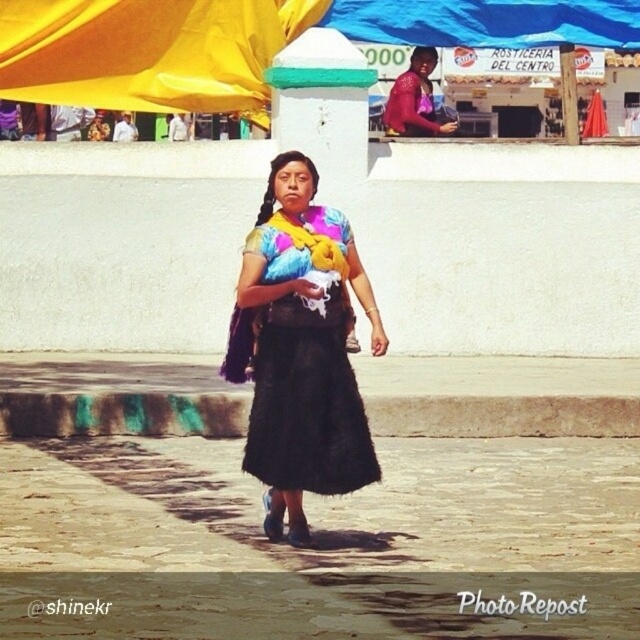
Is yellow fabric canopy at upper left positioned at the back of blue tarpaulin at upper center?

That is False.

Is point (296, 19) positioned in front of point (493, 40)?

Yes, point (296, 19) is in front of point (493, 40).

Identify the location of yellow fabric canopy at upper left. (148, 52).

Is yellow fabric canopy at upper left to the left of matte red blouse at upper center from the viewer's perspective?

Indeed, yellow fabric canopy at upper left is positioned on the left side of matte red blouse at upper center.

Is point (106, 74) farther from camera compared to point (433, 113)?

No, it is in front of (433, 113).

At what (x,y) coordinates should I click in order to perform the action: click on yellow fabric canopy at upper left. Please return your answer as a coordinate pair (x, y). Looking at the image, I should click on (148, 52).

Who is positioned more to the left, blue tarpaulin at upper center or matte red blouse at upper center?

matte red blouse at upper center

Consider the image. Who is more forward, (616, 19) or (403, 104)?

Point (403, 104) is more forward.

Find the location of `blue tarpaulin at upper center`. blue tarpaulin at upper center is located at coordinates (488, 22).